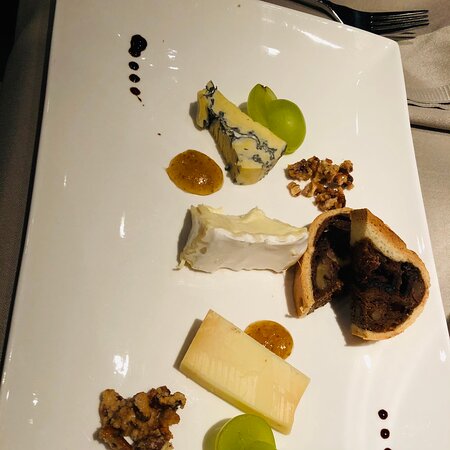
At what (x,y) coordinates should I click in order to perform the action: click on fork. Please return your answer as a coordinate pair (x, y). This screenshot has height=450, width=450. Looking at the image, I should click on [x=382, y=16].